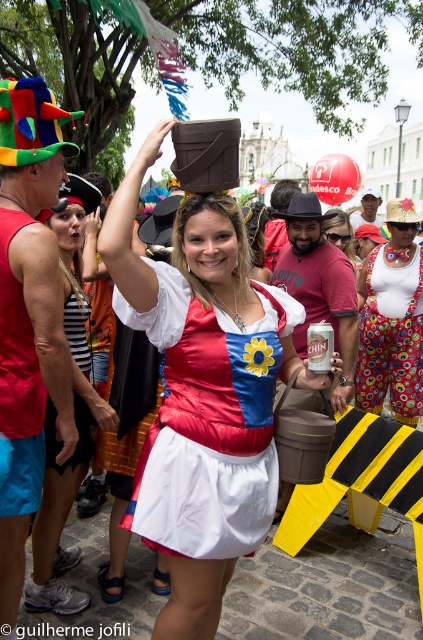
Is satin dress at center smaller than brushed metal can at center?

Yes.

Who is positioned more to the left, satin dress at center or brushed metal can at center?

satin dress at center

Image resolution: width=423 pixels, height=640 pixels. I want to click on satin dress at center, so click(x=208, y=422).

You are a GUI agent. You are given a task and a screenshot of the screen. Output one action in this format:
    pyautogui.click(x=<x>, y=<y>)
    Task: Click on the satin dress at center
    The height and width of the screenshot is (640, 423).
    Given the screenshot: What is the action you would take?
    pyautogui.click(x=208, y=422)

Can you confirm if matte brown hat at upper center is positioned to the right of brushed metal can at center?

Incorrect, matte brown hat at upper center is not on the right side of brushed metal can at center.

Does point (136, 300) lie in front of point (312, 209)?

Yes, it is in front of point (312, 209).

The image size is (423, 640). Identify the location of matte brown hat at upper center. (203, 392).

Is point (172, 509) positioned behind point (13, 189)?

No.

Does matte brown hat at upper center appear under red fabric tank top at left?

Yes, matte brown hat at upper center is below red fabric tank top at left.

Is point (170, 563) closer to camera compared to point (11, 298)?

That is True.

You are a GUI agent. You are given a task and a screenshot of the screen. Output one action in this format:
    pyautogui.click(x=<x>, y=<y>)
    Task: Click on the matte brown hat at upper center
    
    Given the screenshot: What is the action you would take?
    pyautogui.click(x=203, y=392)